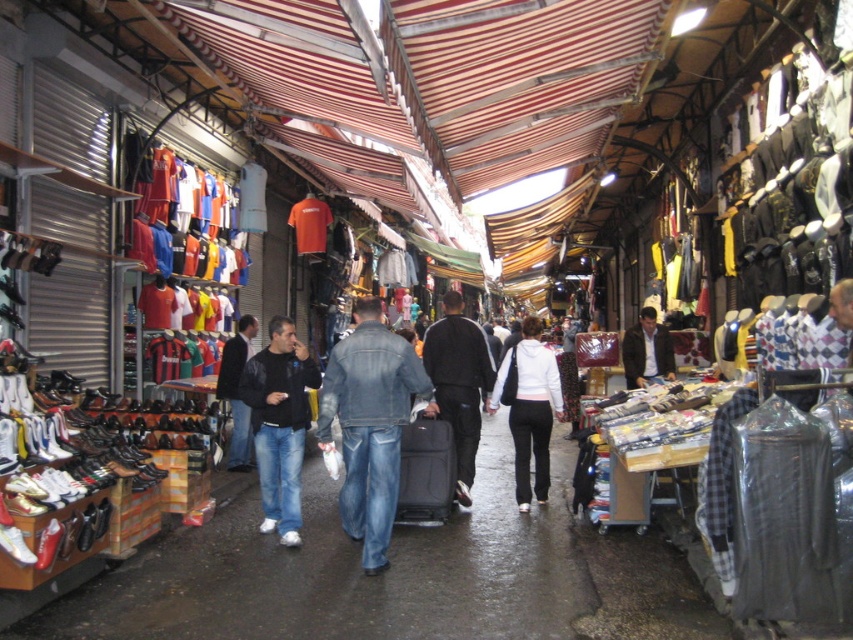
Is dark blue leather jacket at center bigger than dark brown leather jacket at center?

No, dark blue leather jacket at center is not bigger than dark brown leather jacket at center.

Between dark blue leather jacket at center and dark brown leather jacket at center, which one appears on the right side from the viewer's perspective?

→ Positioned to the right is dark brown leather jacket at center.

You are a GUI agent. You are given a task and a screenshot of the screen. Output one action in this format:
    pyautogui.click(x=<x>, y=<y>)
    Task: Click on the dark blue leather jacket at center
    This screenshot has width=853, height=640.
    Given the screenshot: What is the action you would take?
    pyautogui.click(x=236, y=392)

Looking at this image, who is more distant from viewer, (297,376) or (430,346)?

Point (430,346)

Locate an element on the screen. This screenshot has width=853, height=640. black leather jacket at center is located at coordinates (279, 422).

This screenshot has height=640, width=853. Identify the location of black leather jacket at center. (279, 422).

Locate an element on the screen. This screenshot has width=853, height=640. black leather jacket at center is located at coordinates (279, 422).

Looking at this image, between white fleece pants at center and dark brown leather jacket at center, which one appears on the right side from the viewer's perspective?

Positioned to the right is dark brown leather jacket at center.

Between white fleece pants at center and dark brown leather jacket at center, which one appears on the left side from the viewer's perspective?

white fleece pants at center

Describe the element at coordinates (529, 408) in the screenshot. I see `white fleece pants at center` at that location.

You are a GUI agent. You are given a task and a screenshot of the screen. Output one action in this format:
    pyautogui.click(x=<x>, y=<y>)
    Task: Click on the white fleece pants at center
    Image resolution: width=853 pixels, height=640 pixels.
    Given the screenshot: What is the action you would take?
    coord(529,408)